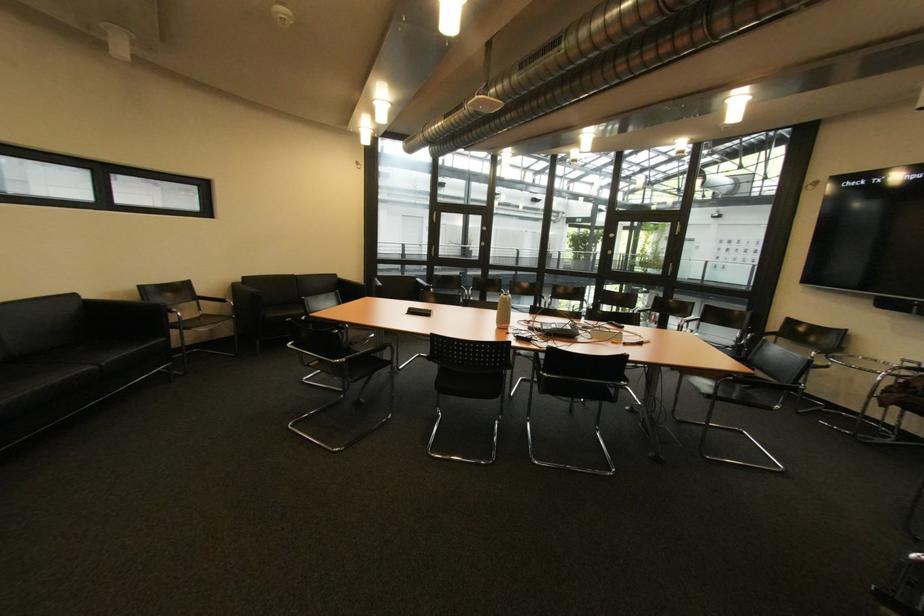
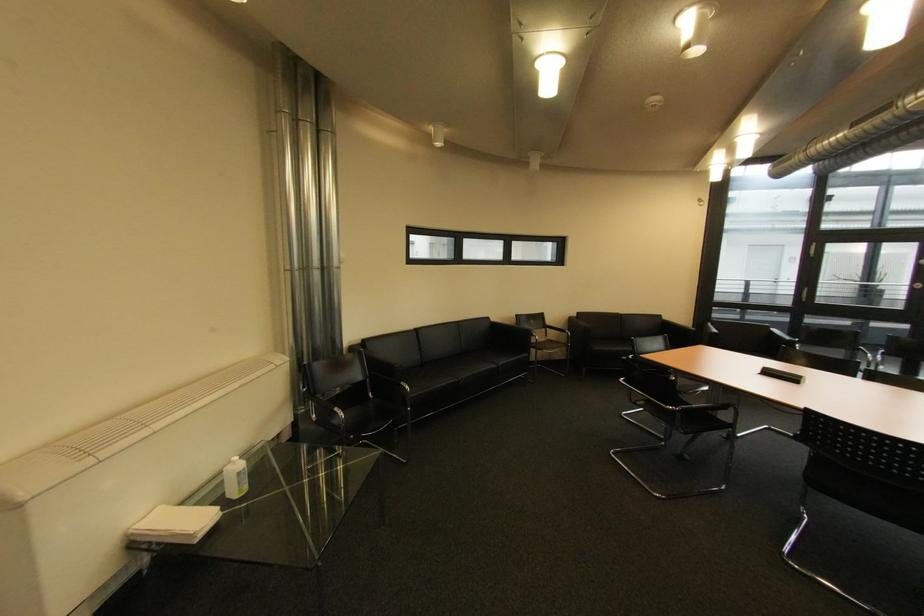
In the second image, find the point that corresponds to pixel 359 347 in the first image.

(687, 395)